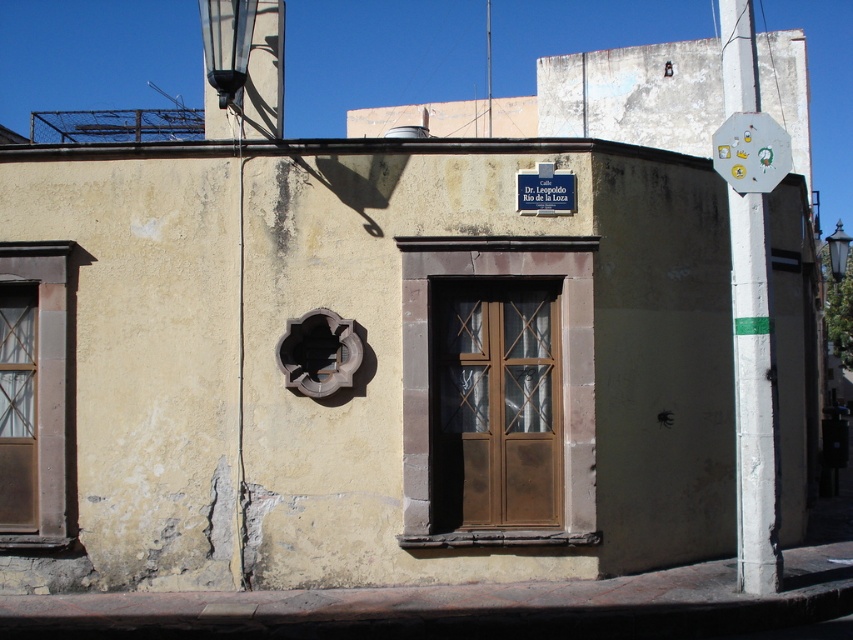
Is matte brown window at left thinner than metallic octagonal sign at upper right?

In fact, matte brown window at left might be wider than metallic octagonal sign at upper right.

Who is positioned more to the right, matte brown window at left or metallic octagonal sign at upper right?

metallic octagonal sign at upper right

What do you see at coordinates (32, 394) in the screenshot? This screenshot has height=640, width=853. I see `matte brown window at left` at bounding box center [32, 394].

The image size is (853, 640). Find the location of `matte brown window at left`. matte brown window at left is located at coordinates (32, 394).

Does brown wooden door at center lie in front of matte brown window at left?

No, it is behind matte brown window at left.

Who is more distant from viewer, (485, 417) or (32, 385)?

Point (32, 385)

You are a GUI agent. You are given a task and a screenshot of the screen. Output one action in this format:
    pyautogui.click(x=<x>, y=<y>)
    Task: Click on the brown wooden door at center
    
    Given the screenshot: What is the action you would take?
    pyautogui.click(x=495, y=404)

Is brown wooden door at center positioned before metallic octagonal sign at upper right?

No.

Locate an element on the screen. The height and width of the screenshot is (640, 853). brown wooden door at center is located at coordinates (495, 404).

Is point (442, 365) positioned behind point (732, 145)?

Yes.

The image size is (853, 640). What are the coordinates of `brown wooden door at center` in the screenshot? It's located at (495, 404).